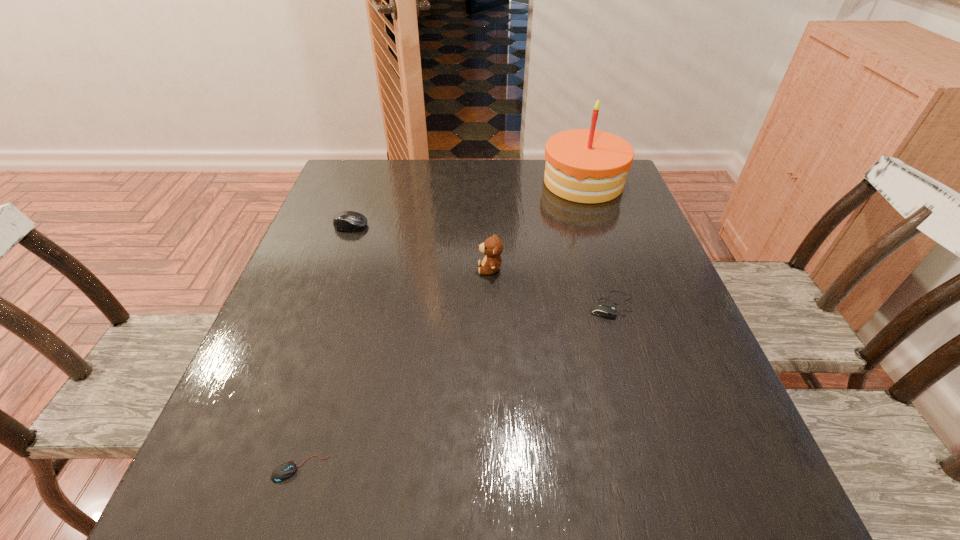
The width and height of the screenshot is (960, 540). I want to click on the tallest object, so click(x=589, y=166).

The width and height of the screenshot is (960, 540). What are the coordinates of `birthday cake` in the screenshot? It's located at (589, 166).

At what (x,y) coordinates should I click in order to perform the action: click on teddy bear. Please return your answer as a coordinate pair (x, y). Looking at the image, I should click on (492, 247).

Image resolution: width=960 pixels, height=540 pixels. Find the location of `the third farthest object`. the third farthest object is located at coordinates (492, 247).

This screenshot has height=540, width=960. I want to click on the fourth nearest object, so click(x=346, y=220).

Identify the location of the third shortest object. (346, 220).

This screenshot has height=540, width=960. I want to click on the second shortest object, so click(601, 309).

Image resolution: width=960 pixels, height=540 pixels. In order to click on the second tallest mouse in this screenshot , I will do `click(601, 309)`.

Image resolution: width=960 pixels, height=540 pixels. I want to click on the nearest object, so (x=285, y=470).

You are a GUI agent. You are given a task and a screenshot of the screen. Output one action in this format:
    pyautogui.click(x=<x>, y=<y>)
    Task: Click on the nearest mouse
    
    Given the screenshot: What is the action you would take?
    pyautogui.click(x=285, y=470)